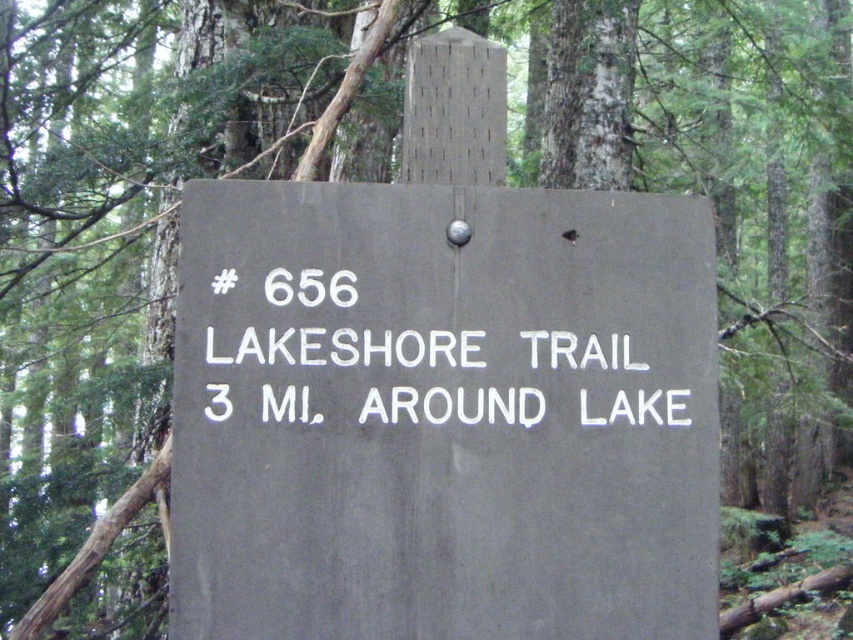
Question: Which point is farther to the camera?

Choices:
 (A) (523, 456)
 (B) (285, 396)

Answer: (A)

Question: Can you confirm if gray matte sign at center is positioned above white painted text at center?

Choices:
 (A) yes
 (B) no

Answer: (B)

Question: Is gray matte sign at center positioned at the back of white painted text at center?

Choices:
 (A) yes
 (B) no

Answer: (B)

Question: Which object appears farthest from the camera in this image?

Choices:
 (A) white painted text at center
 (B) gray matte sign at center

Answer: (A)

Question: Where is gray matte sign at center located in relation to white painted text at center in the image?

Choices:
 (A) left
 (B) right

Answer: (A)